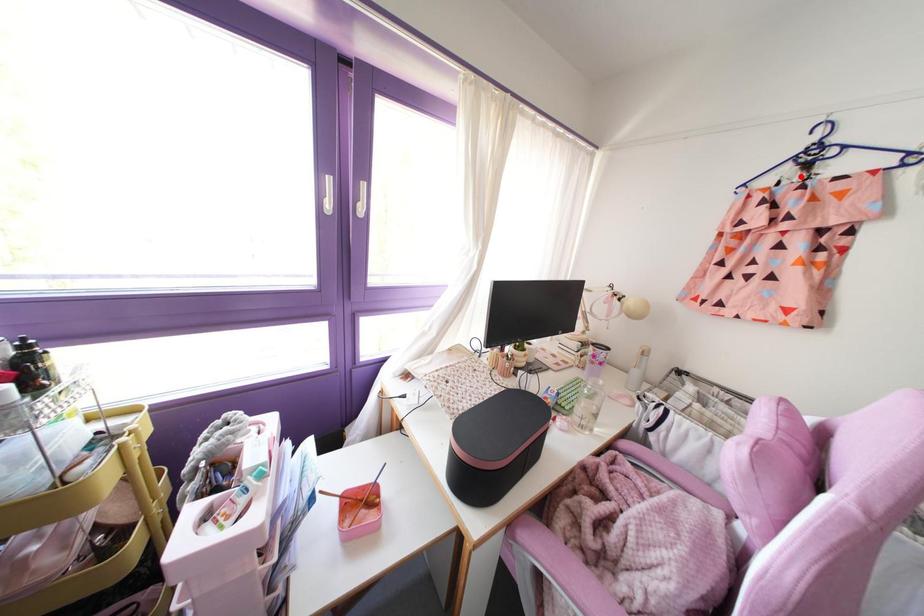
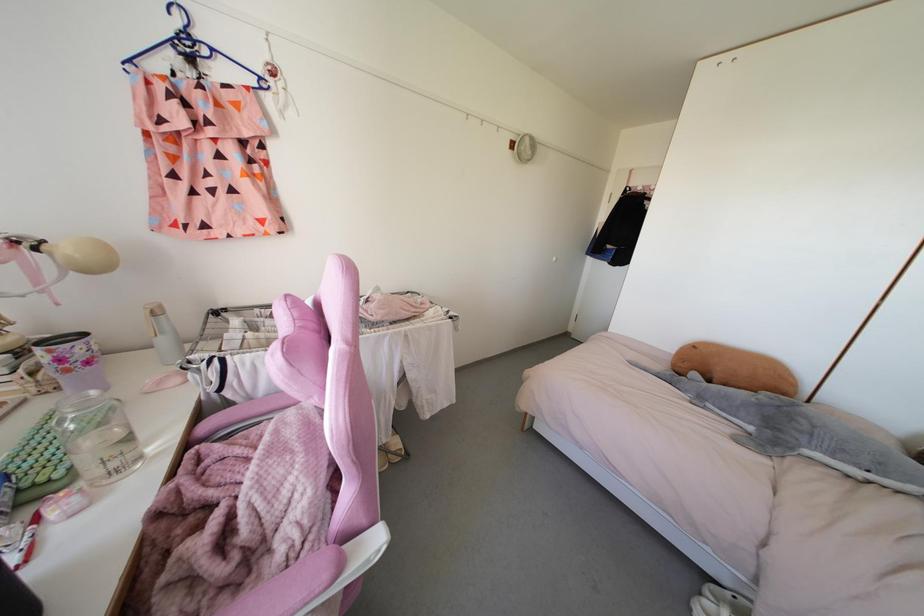
Where in the second image is the point corresponding to the highlighted location from the first image?

(191, 73)